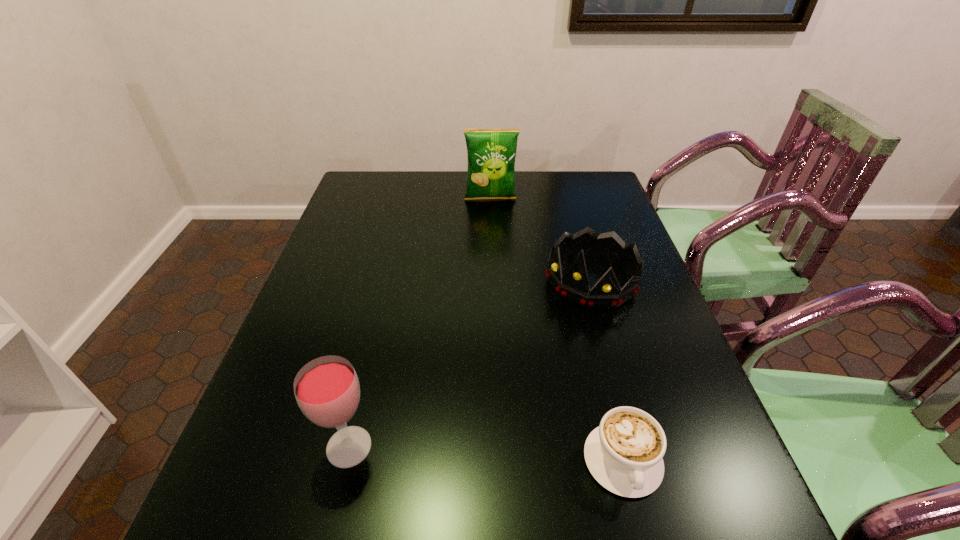
The height and width of the screenshot is (540, 960). Identify the location of free space between the third shortest object and the third object from right to left. coord(420,323).

Find the location of a particular element. vacant area that lies between the crisp (potato chip) and the cappuccino is located at coordinates click(557, 330).

In order to click on free space that is in between the shortest object and the leftmost object in this screenshot , I will do click(x=486, y=454).

This screenshot has height=540, width=960. In order to click on empty location between the wineglass and the farthest object in this screenshot , I will do `click(420, 323)`.

This screenshot has height=540, width=960. Identify the location of object that is the closest to the third tallest object. (491, 153).

I want to click on object that is the third nearest to the second tallest object, so click(x=491, y=153).

Where is `blank area in the image that satisfies the following two spatial constraints: 1. on the front side of the tiara; 2. on the left side of the third object from right to left`? Image resolution: width=960 pixels, height=540 pixels. blank area in the image that satisfies the following two spatial constraints: 1. on the front side of the tiara; 2. on the left side of the third object from right to left is located at coordinates (493, 280).

The image size is (960, 540). Find the location of `vacant space that satisfies the following two spatial constraints: 1. on the back side of the leftmost object; 2. on the right side of the farthest object`. vacant space that satisfies the following two spatial constraints: 1. on the back side of the leftmost object; 2. on the right side of the farthest object is located at coordinates (408, 199).

Image resolution: width=960 pixels, height=540 pixels. Find the location of `vacant region that satisfies the following two spatial constraints: 1. on the front side of the third nearest object; 2. on the right side of the third object from right to left`. vacant region that satisfies the following two spatial constraints: 1. on the front side of the third nearest object; 2. on the right side of the third object from right to left is located at coordinates (493, 280).

I want to click on free space that satisfies the following two spatial constraints: 1. on the back side of the third shortest object; 2. on the left side of the second object from left to right, so click(408, 199).